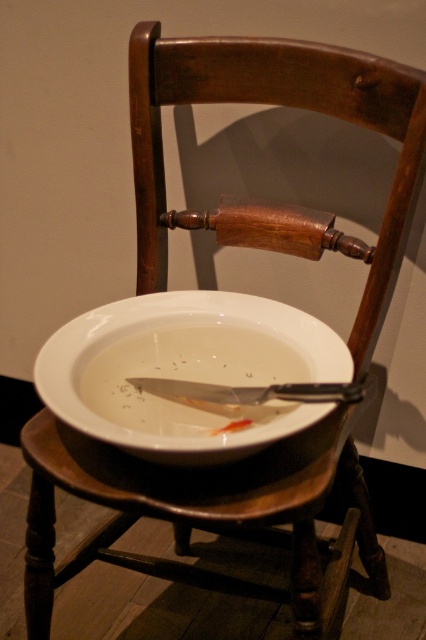
Which is more to the right, white glossy soup bowl at center or shiny silver knife at center?

shiny silver knife at center

Can you confirm if white glossy soup bowl at center is positioned to the left of shiny silver knife at center?

Yes, white glossy soup bowl at center is to the left of shiny silver knife at center.

Which is behind, point (330, 340) or point (328, 396)?

The point (330, 340) is more distant.

The height and width of the screenshot is (640, 426). What are the coordinates of `white glossy soup bowl at center` in the screenshot? It's located at (187, 371).

Which of these two, wooden stool at center or white glossy soup bowl at center, stands shorter?

white glossy soup bowl at center

Is point (356, 458) farther from camera compared to point (204, 369)?

Yes, point (356, 458) is behind point (204, 369).

Locate an element on the screen. wooden stool at center is located at coordinates tap(203, 516).

Who is higher up, wooden stool at center or shiny silver knife at center?

Positioned higher is shiny silver knife at center.

From the picture: Is wooden stool at center to the left of shiny silver knife at center from the viewer's perspective?

Incorrect, wooden stool at center is not on the left side of shiny silver knife at center.

Where is `wooden stool at center`? The height and width of the screenshot is (640, 426). wooden stool at center is located at coordinates (203, 516).